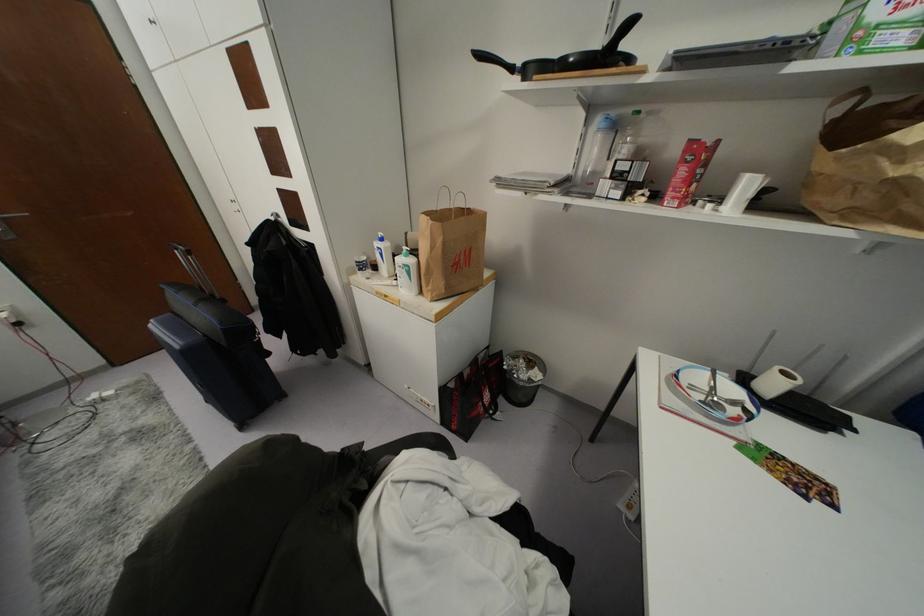
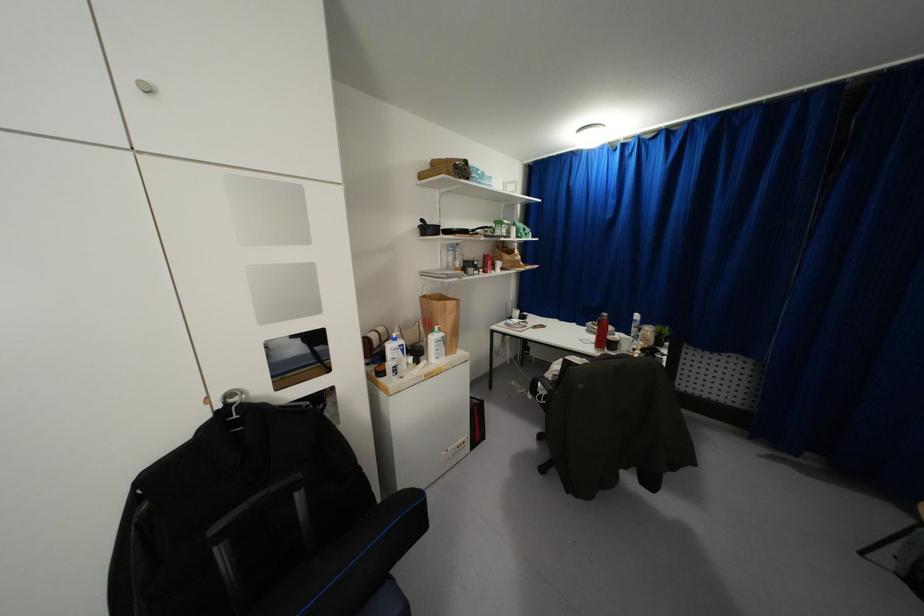
Find the pixel in the second image that matches [381,254] in the first image.

(402, 350)